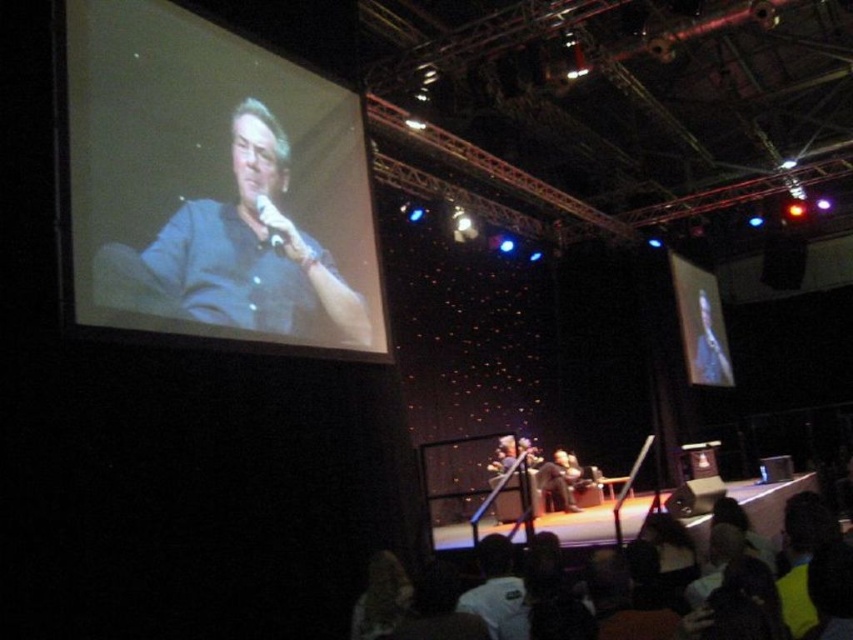
You are an event technician who needs to adjust the lighting for the stage. You see the matte black screen at upper left and the matte black microphone at upper left. Which object is taller?

The matte black screen at upper left is taller than the matte black microphone at upper left according to the description.

You are an event technician setting up a camera to capture the matte black screen at upper left. The camera is placed at the origin point. What is the direction you should aim the camera to ensure the screen is in frame?

The matte black screen at upper left is located at point (212, 184), so the camera should be aimed towards that coordinate to capture the screen.